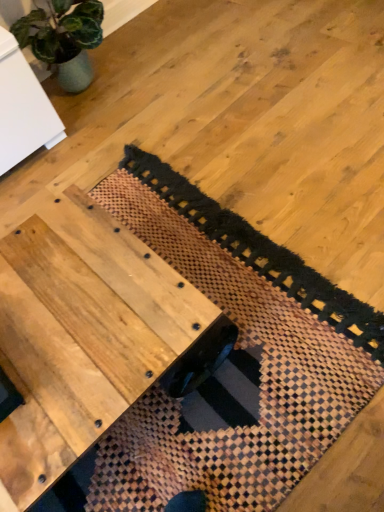
Find the location of `vacant location behind wooden woven mat at center`. vacant location behind wooden woven mat at center is located at coordinates (174, 101).